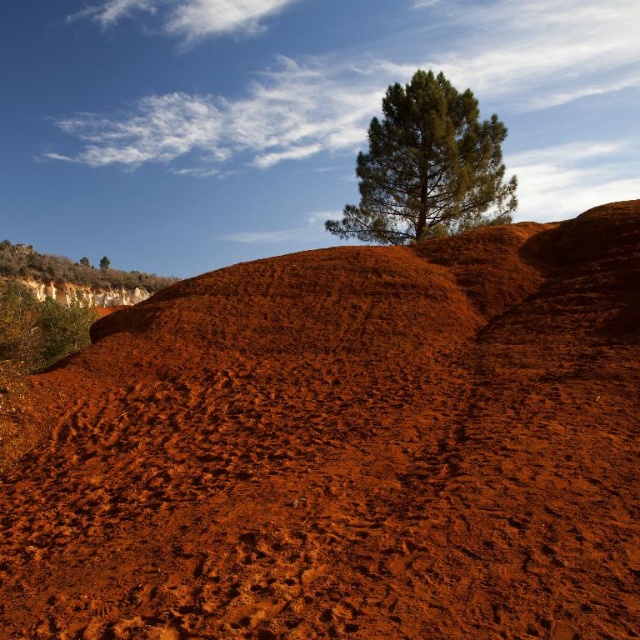
Who is more distant from viewer, [112,358] or [452,140]?

The point [452,140] is more distant.

Does dusty red soil at center appear under green textured tree at upper center?

Correct, dusty red soil at center is located below green textured tree at upper center.

Is point (440, 580) less distant than point (384, 243)?

Yes, it is in front of point (384, 243).

I want to click on dusty red soil at center, so click(342, 449).

Based on the photo, is dusty red soil at center above green leafy tree at upper left?

Incorrect, dusty red soil at center is not positioned above green leafy tree at upper left.

In the scene shown: Who is more distant from viewer, (186, 348) or (77, 275)?

Point (77, 275)

Which is in front, point (332, 326) or point (160, 278)?

Point (332, 326) is in front.

Identify the location of dusty red soil at center. (342, 449).

Is green textured tree at upper center thinner than green textured tree at upper left?

Indeed, green textured tree at upper center has a lesser width compared to green textured tree at upper left.

Between green textured tree at upper center and green textured tree at upper left, which one is positioned lower?

green textured tree at upper center is below.

This screenshot has height=640, width=640. Describe the element at coordinates (428, 166) in the screenshot. I see `green textured tree at upper center` at that location.

Find the location of a particular element. green textured tree at upper center is located at coordinates (428, 166).